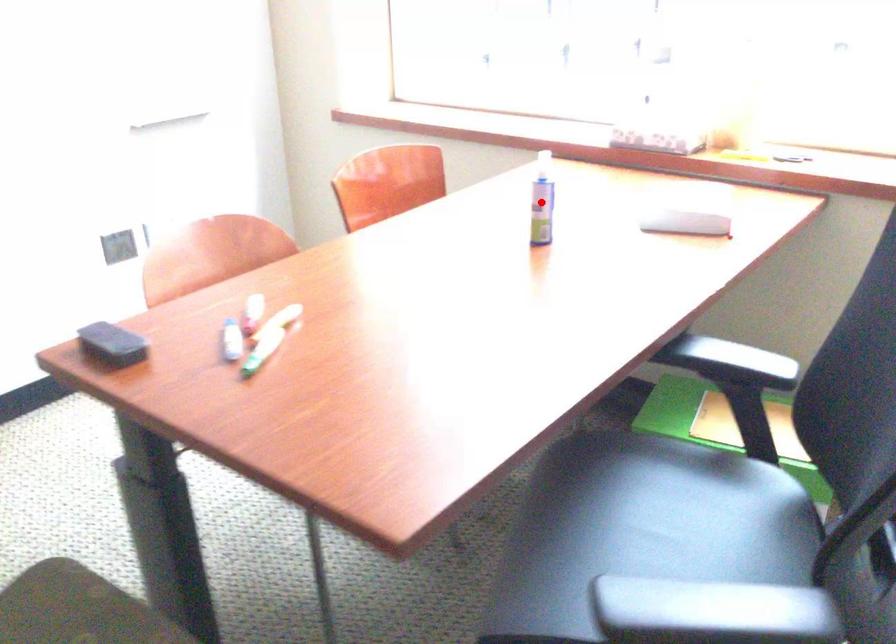
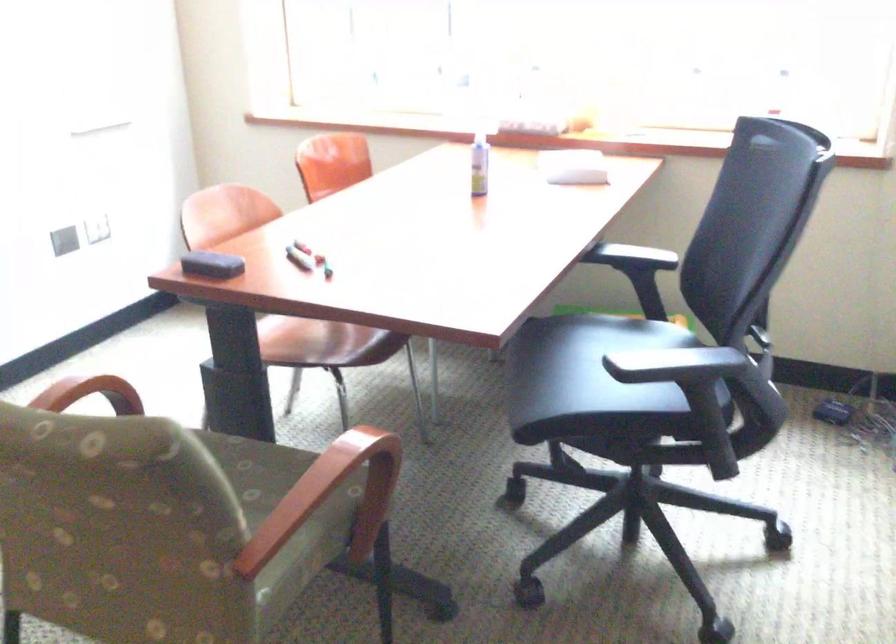
The point at the highlighted location is marked in the first image. Where is the corresponding point in the second image?

(478, 164)